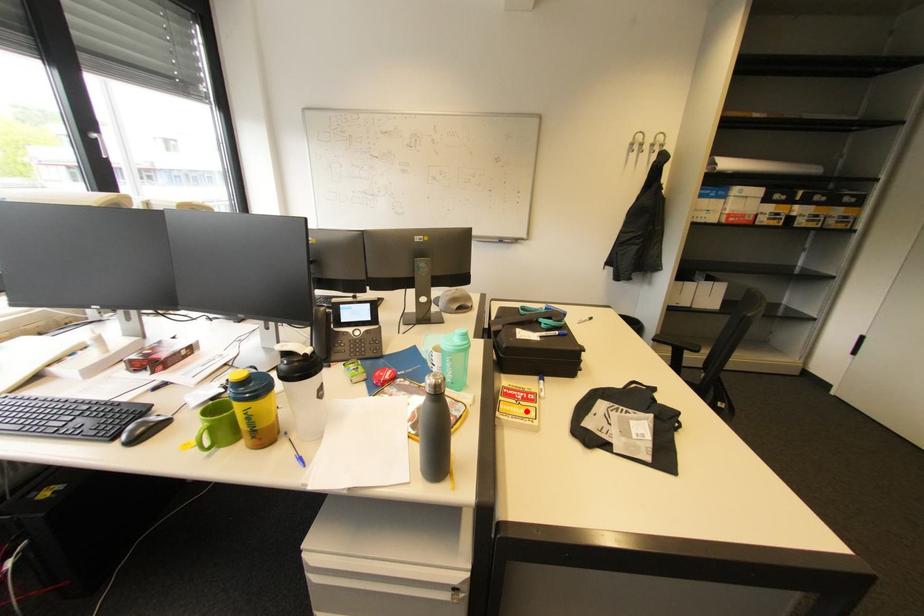
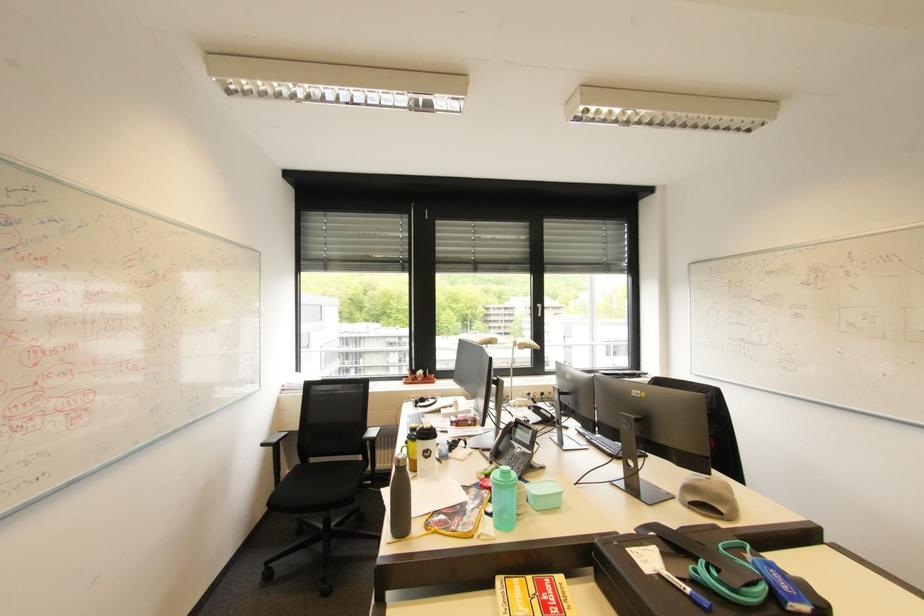
Where in the second image is the point corresponding to the highlighted location from the first image?

(526, 602)